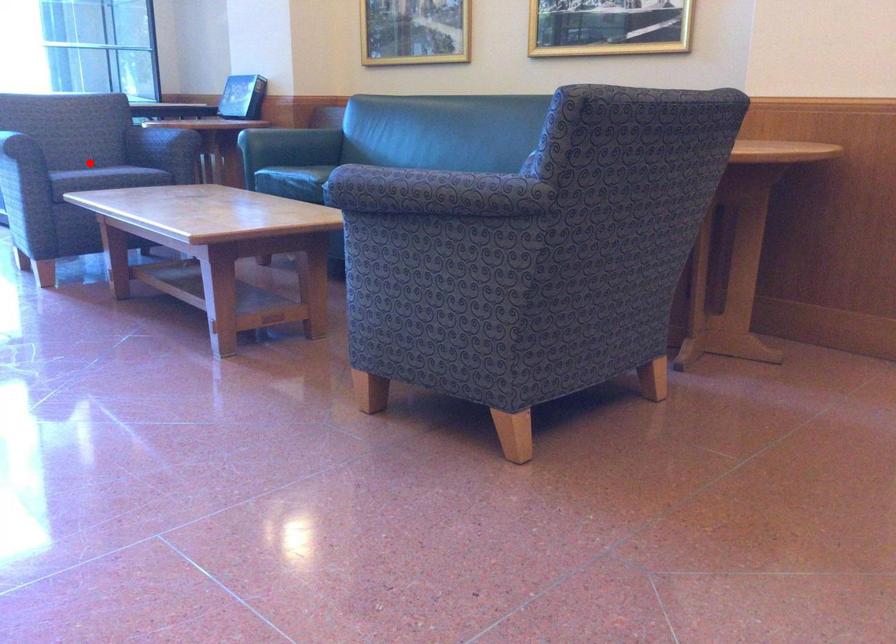
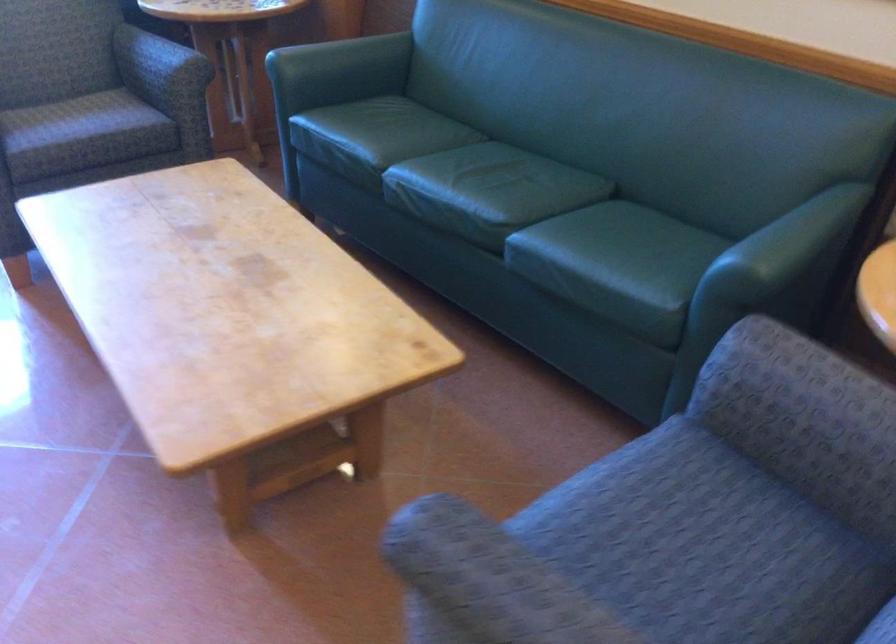
Question: I am providing you with two images of the same scene from different viewpoints. In image1, a red point is highlighted. Considering the same 3D point in image2, which of the following is correct?

Choices:
 (A) It is closer
 (B) It is farther

Answer: (A)